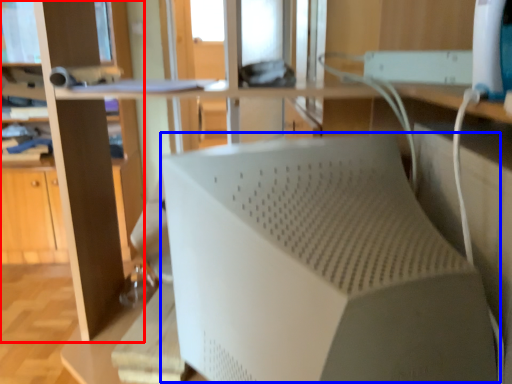
Question: Which object is closer to the camera taking this photo, bookshelf (highlighted by a red box) or wide (highlighted by a blue box)?

Choices:
 (A) bookshelf
 (B) wide

Answer: (B)